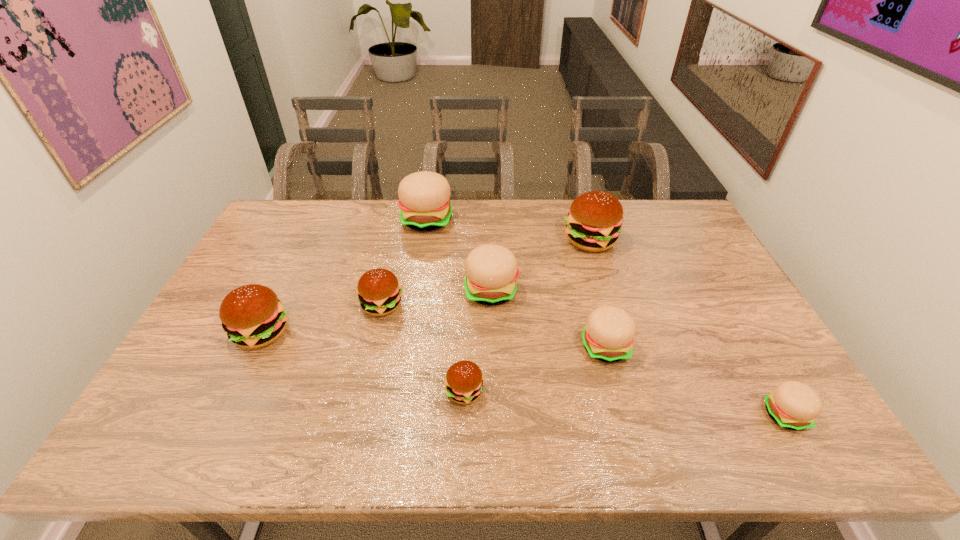
At what (x,y) coordinates should I click in order to perform the action: click on the second nearest beige hamburger. Please return your answer as a coordinate pair (x, y). Looking at the image, I should click on (608, 336).

I want to click on the nearest brown hamburger, so click(x=464, y=382).

Image resolution: width=960 pixels, height=540 pixels. Identify the location of the third brown hamburger from left to right. (464, 382).

Locate an element on the screen. the nearest beige hamburger is located at coordinates pos(793,405).

This screenshot has width=960, height=540. Find the location of `the smallest beige hamburger`. the smallest beige hamburger is located at coordinates (793, 405).

What are the coordinates of `vacant space located 0.330m on the left of the farthest brown hamburger` in the screenshot? It's located at (467, 240).

At what (x,y) coordinates should I click in order to perform the action: click on blank space located on the front of the biggest beige hamburger. Please return your answer as a coordinate pair (x, y). Looking at the image, I should click on pos(412,318).

Identify the location of free space located 0.050m on the back of the leftmost object. (277, 299).

Image resolution: width=960 pixels, height=540 pixels. Identify the location of free region located 0.100m on the front of the third smallest beige hamburger. (492, 336).

The height and width of the screenshot is (540, 960). I want to click on vacant space situated 0.180m on the right of the third biggest brown hamburger, so click(466, 305).